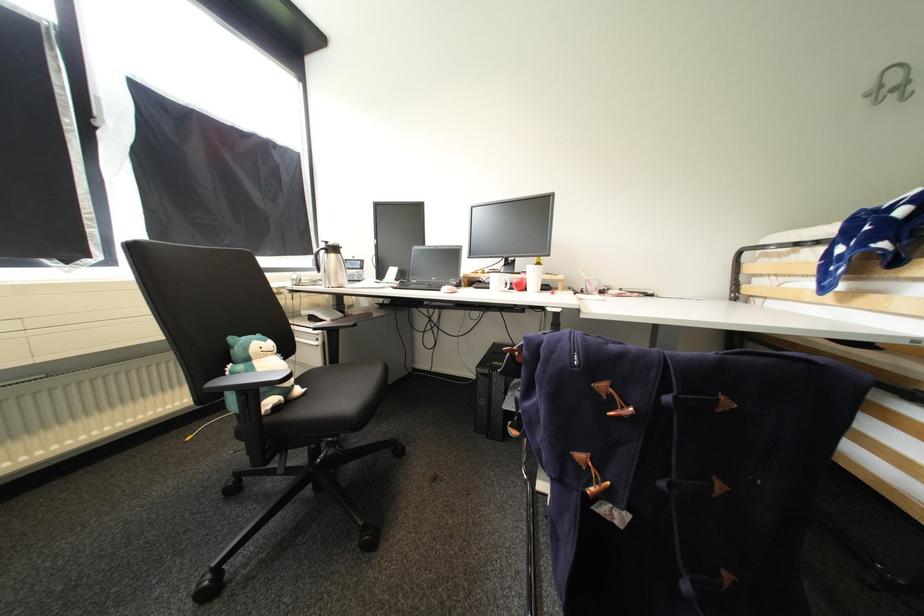
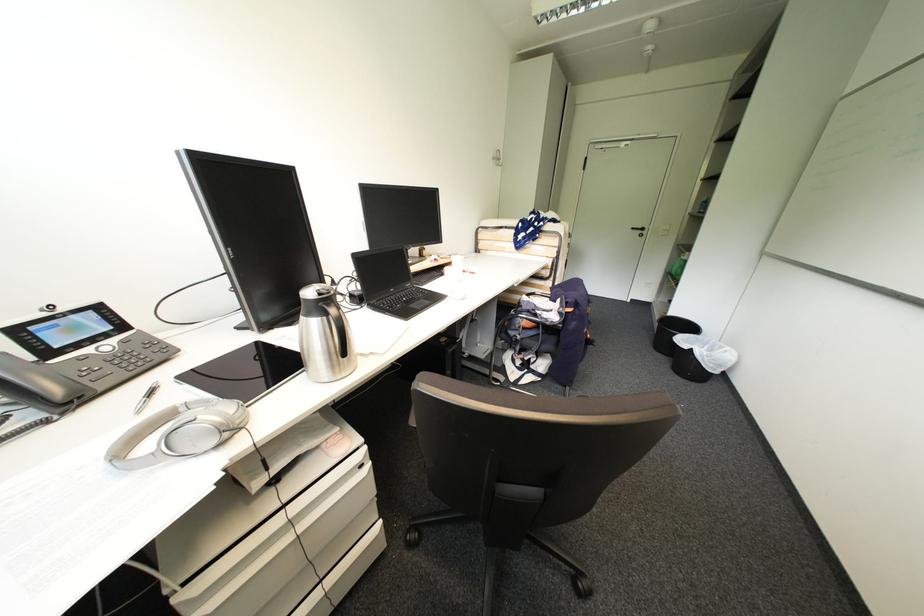
Question: I am providing you with two images of the same scene from different viewpoints. After the viewpoint changes to image2, which objects are now occluded?

Choices:
 (A) phone handset
 (B) blue laptop case
 (C) black chair sitting surface
 (D) drawer handle recess

Answer: (C)